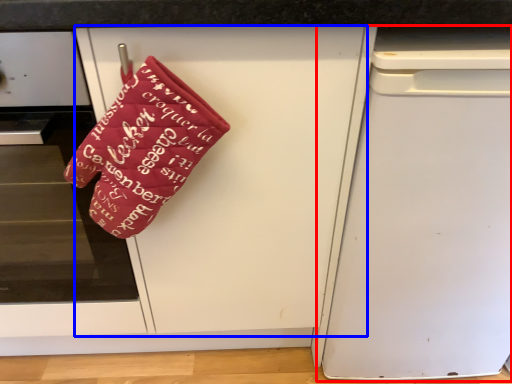
Question: Which object appears farthest to the camera in this image, dish washer (highlighted by a red box) or door (highlighted by a blue box)?

Choices:
 (A) dish washer
 (B) door

Answer: (A)